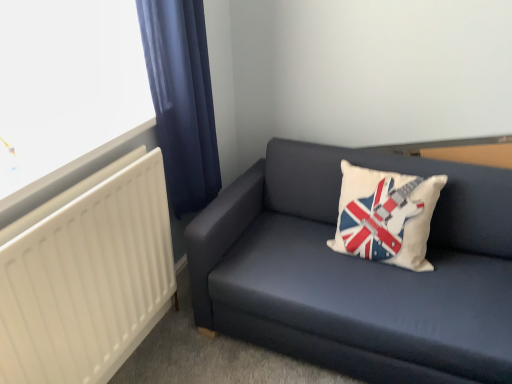
Question: Is the position of dark blue fabric couch at lower right less distant than that of white matte radiator at left?

Choices:
 (A) no
 (B) yes

Answer: (A)

Question: Is dark blue fabric couch at lower right bigger than white matte radiator at left?

Choices:
 (A) yes
 (B) no

Answer: (A)

Question: From the image's perspective, is dark blue fabric couch at lower right below white matte radiator at left?

Choices:
 (A) no
 (B) yes

Answer: (A)

Question: Would you say white matte radiator at left is part of dark blue fabric couch at lower right's contents?

Choices:
 (A) no
 (B) yes

Answer: (A)

Question: Considering the relative sizes of dark blue fabric couch at lower right and white matte radiator at left in the image provided, is dark blue fabric couch at lower right smaller than white matte radiator at left?

Choices:
 (A) no
 (B) yes

Answer: (A)

Question: Is dark blue fabric couch at lower right taller than white matte radiator at left?

Choices:
 (A) yes
 (B) no

Answer: (B)

Question: Considering the relative sizes of white fabric pillow with union jack design at center and dark blue fabric curtain at left in the image provided, is white fabric pillow with union jack design at center shorter than dark blue fabric curtain at left?

Choices:
 (A) no
 (B) yes

Answer: (B)

Question: From the image's perspective, is white fabric pillow with union jack design at center located beneath dark blue fabric curtain at left?

Choices:
 (A) no
 (B) yes

Answer: (B)

Question: From a real-world perspective, is white fabric pillow with union jack design at center physically below dark blue fabric curtain at left?

Choices:
 (A) yes
 (B) no

Answer: (A)

Question: Is white fabric pillow with union jack design at center not near dark blue fabric curtain at left?

Choices:
 (A) no
 (B) yes

Answer: (A)

Question: Is white fabric pillow with union jack design at center wider than dark blue fabric curtain at left?

Choices:
 (A) yes
 (B) no

Answer: (A)

Question: Is white fabric pillow with union jack design at center at the right side of dark blue fabric curtain at left?

Choices:
 (A) no
 (B) yes

Answer: (B)

Question: From a real-world perspective, does dark blue fabric curtain at left sit lower than dark blue fabric couch at lower right?

Choices:
 (A) no
 (B) yes

Answer: (A)